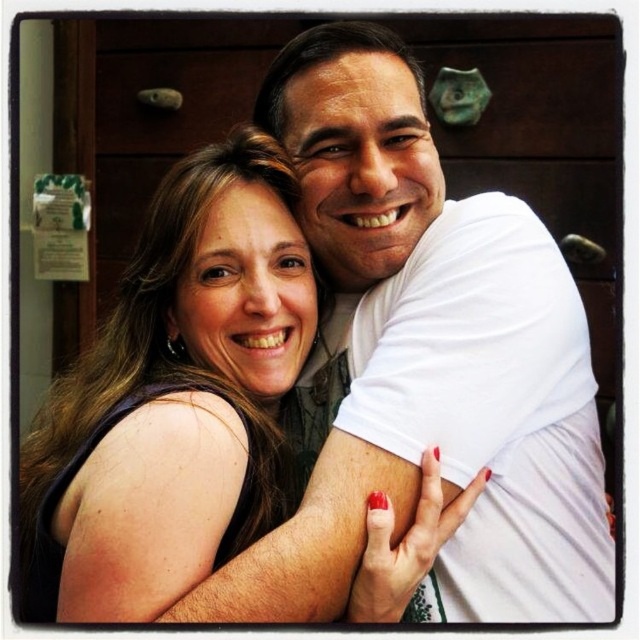
Question: Is white cotton t-shirt at upper right wider than matte black dress at center?

Choices:
 (A) no
 (B) yes

Answer: (A)

Question: Which point is closer to the camera?

Choices:
 (A) (385, 29)
 (B) (244, 266)

Answer: (B)

Question: Which object appears closest to the camera in this image?

Choices:
 (A) matte black dress at center
 (B) white cotton t-shirt at upper right

Answer: (A)

Question: Can you confirm if white cotton t-shirt at upper right is positioned above matte black dress at center?

Choices:
 (A) yes
 (B) no

Answer: (A)

Question: Does white cotton t-shirt at upper right appear on the left side of matte black dress at center?

Choices:
 (A) yes
 (B) no

Answer: (B)